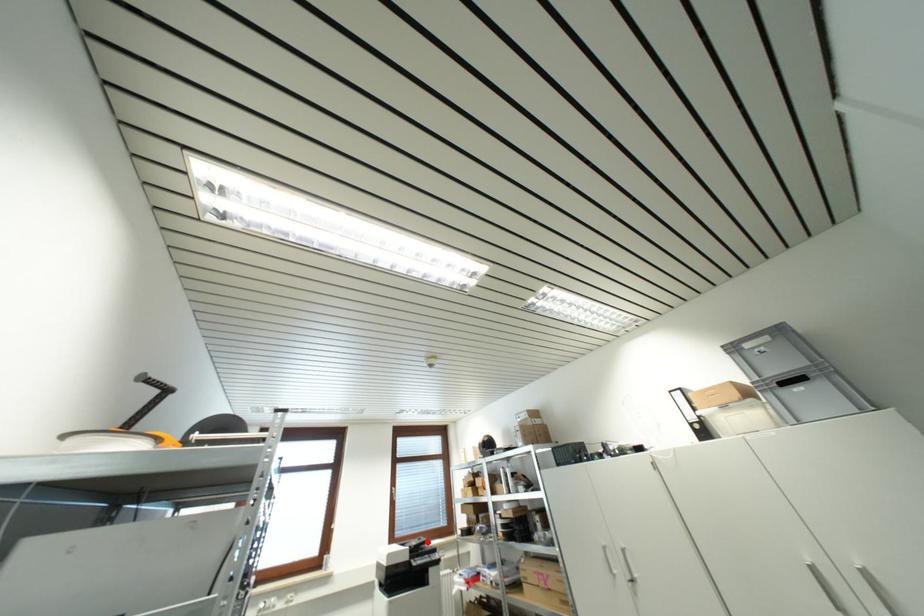
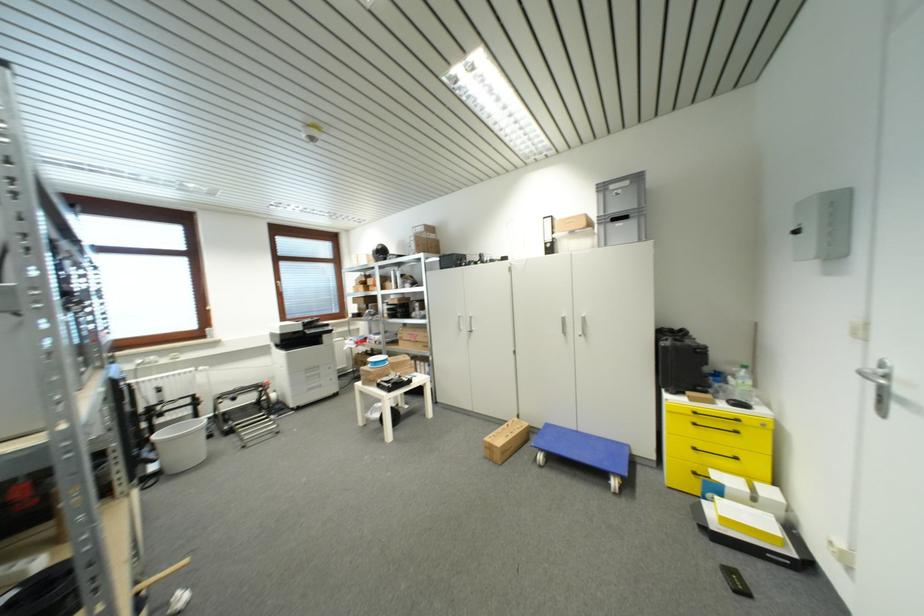
Question: I am providing you with two images of the same scene from different viewpoints. A red point is marked on the first image. Is the red point's position out of view in image 2?

Choices:
 (A) Yes
 (B) No

Answer: (B)